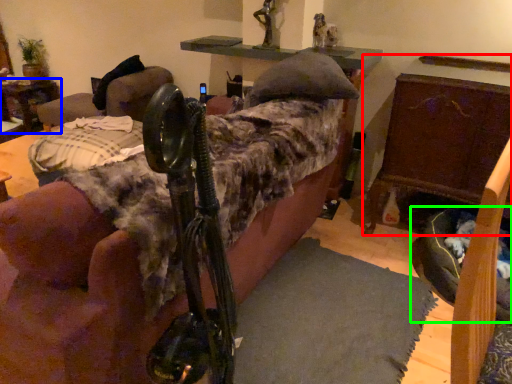
Question: Which is nearer to the furniture (highlighted by a red box)? table (highlighted by a blue box) or dog bed (highlighted by a green box).

Choices:
 (A) table
 (B) dog bed

Answer: (B)